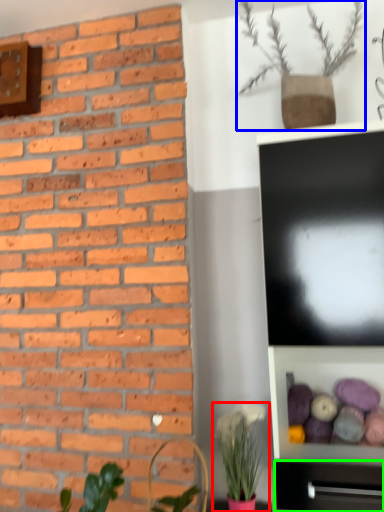
Question: Considering the real-world distances, which object is closest to houseplant (highlighted by a red box)? houseplant (highlighted by a blue box) or tv cabinet (highlighted by a green box).

Choices:
 (A) houseplant
 (B) tv cabinet

Answer: (B)